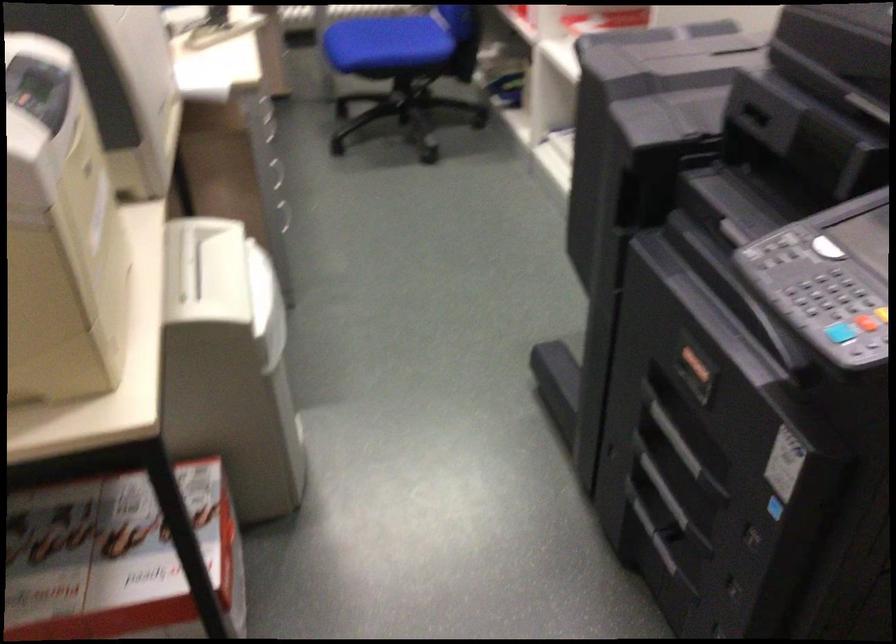
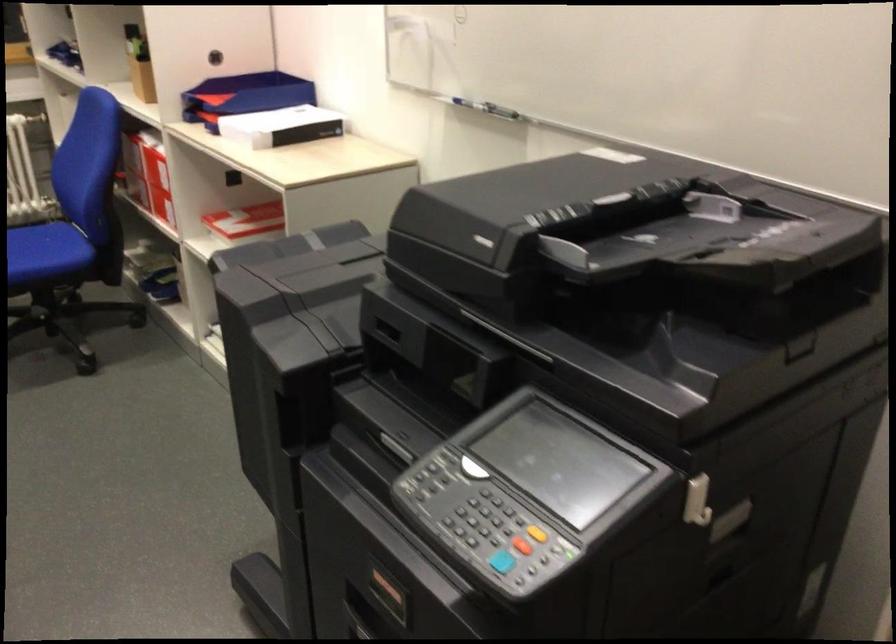
Where in the second image is the point corresponding to (x=808, y=283) from the first image?

(470, 514)